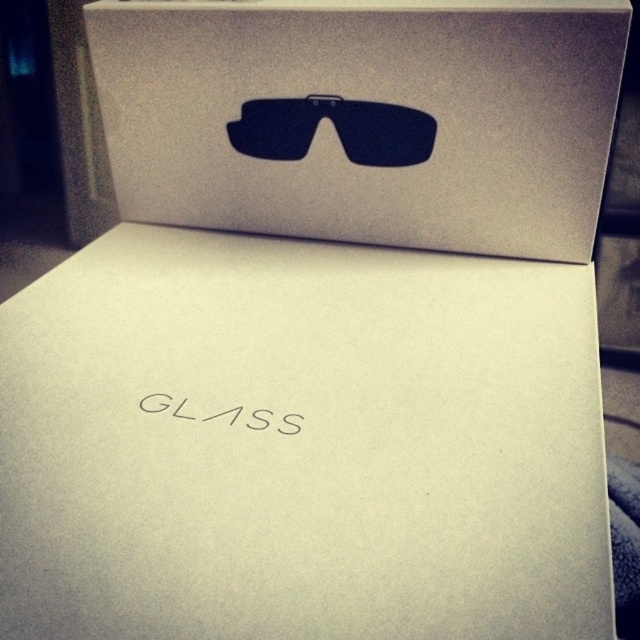
Question: Which point is closer to the camera?

Choices:
 (A) matte black goggles at center
 (B) white matte cardboard box at center

Answer: (B)

Question: Does white matte cardboard box at center have a larger size compared to matte black goggles at center?

Choices:
 (A) yes
 (B) no

Answer: (A)

Question: Can you confirm if white matte cardboard box at center is bigger than matte black goggles at center?

Choices:
 (A) no
 (B) yes

Answer: (B)

Question: Which point is closer to the camera taking this photo?

Choices:
 (A) (252, 54)
 (B) (272, 156)

Answer: (A)

Question: Which point appears closest to the camera in this image?

Choices:
 (A) (483, 198)
 (B) (237, 129)

Answer: (A)

Question: Is white matte cardboard box at center smaller than matte black goggles at center?

Choices:
 (A) no
 (B) yes

Answer: (A)